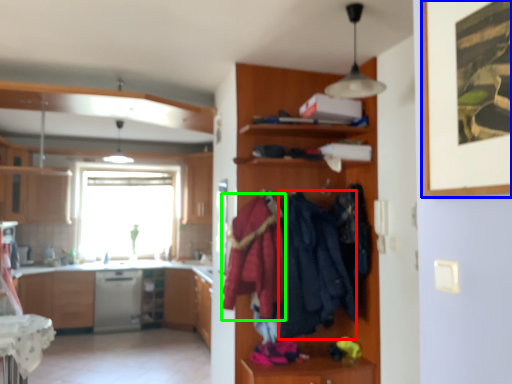
Question: Which object is positioned closest to clothing (highlighted by a red box)? Select from picture frame (highlighted by a blue box) and clothing (highlighted by a green box).

Choices:
 (A) picture frame
 (B) clothing

Answer: (B)